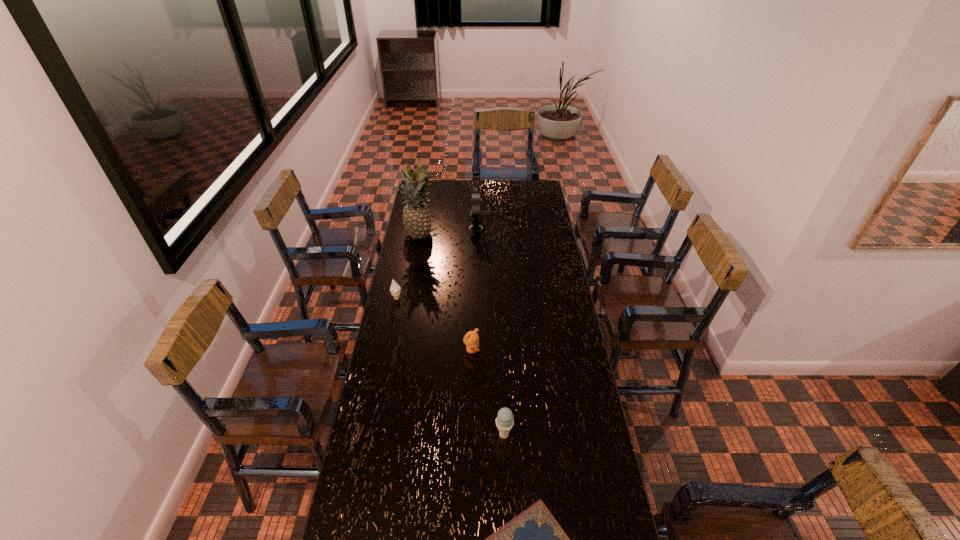
What are the coordinates of `blank space located on the front-facing side of the left icecream` in the screenshot? It's located at (395, 312).

The width and height of the screenshot is (960, 540). What are the coordinates of `blank space located 0.270m on the face of the teddy bear` in the screenshot? It's located at (547, 350).

The height and width of the screenshot is (540, 960). Identify the location of pineapple that is at the left edge. pyautogui.click(x=416, y=219).

You are a GUI agent. You are given a task and a screenshot of the screen. Output one action in this format:
    pyautogui.click(x=<x>, y=<y>)
    Task: Click on the icecream that is at the left edge
    This screenshot has height=540, width=960.
    Given the screenshot: What is the action you would take?
    pyautogui.click(x=395, y=289)

Locate an element on the screen. The image size is (960, 540). free space at the far edge is located at coordinates (475, 191).

You are a GUI agent. You are given a task and a screenshot of the screen. Output one action in this format:
    pyautogui.click(x=<x>, y=<y>)
    Task: Click on the blank space at the left edge
    The width and height of the screenshot is (960, 540).
    Given the screenshot: What is the action you would take?
    pyautogui.click(x=420, y=257)

Identify the location of vacant space at the right edge of the desktop. (540, 224).

Where is `blank region between the teddy bear and the third tallest object`? The width and height of the screenshot is (960, 540). blank region between the teddy bear and the third tallest object is located at coordinates (488, 392).

Find the location of `free space between the third farthest object and the earphone`. free space between the third farthest object and the earphone is located at coordinates (437, 264).

Find the location of a particular element. The width and height of the screenshot is (960, 540). vacant point located between the farther icecream and the teddy bear is located at coordinates (434, 325).